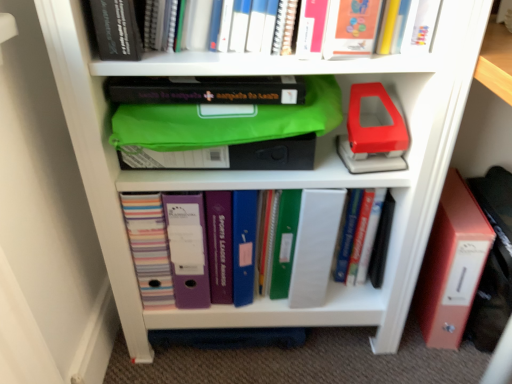
Question: In terms of width, does hardcover book at upper left, which is the 1th book in top-to-bottom order, look wider or thinner when compared to matte plastic folders at center, arranged as the 1th book when viewed from the back?

Choices:
 (A) thin
 (B) wide

Answer: (B)

Question: From the image's perspective, is hardcover book at upper left, which appears as the second book when viewed from the back, positioned above or below matte plastic folders at center, positioned as the first book in bottom-to-top order?

Choices:
 (A) above
 (B) below

Answer: (A)

Question: Considering the relative positions of hardcover book at upper left, which ranks as the first book in front-to-back order, and matte plastic folders at center, placed as the 2th book when sorted from front to back, in the image provided, is hardcover book at upper left, which ranks as the first book in front-to-back order, to the left or to the right of matte plastic folders at center, placed as the 2th book when sorted from front to back,?

Choices:
 (A) left
 (B) right

Answer: (A)

Question: Relative to hardcover book at upper left, which is the 2th book from bottom to top, is matte plastic folders at center, placed as the 2th book when sorted from front to back, in front or behind?

Choices:
 (A) front
 (B) behind

Answer: (B)

Question: Based on their positions, is matte plastic folders at center, which is the 2th book from top to bottom, located to the left or right of hardcover book at upper left, which is the 1th book in top-to-bottom order?

Choices:
 (A) right
 (B) left

Answer: (A)

Question: Does point (133, 248) appear closer or farther from the camera than point (101, 21)?

Choices:
 (A) closer
 (B) farther

Answer: (B)

Question: From their relative heights in the image, would you say matte plastic folders at center, positioned as the first book in bottom-to-top order, is taller or shorter than hardcover book at upper left, which appears as the second book when viewed from the back?

Choices:
 (A) tall
 (B) short

Answer: (A)